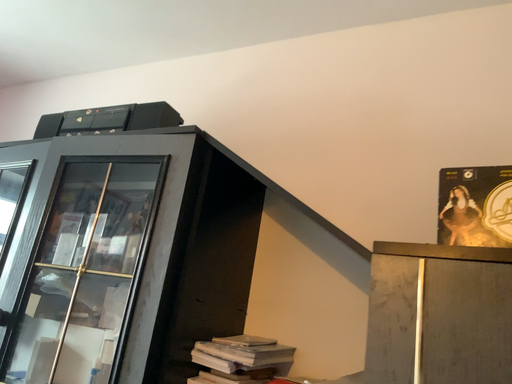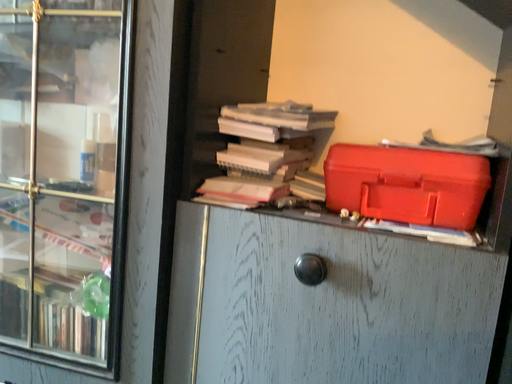
Question: How did the camera likely rotate when shooting the video?

Choices:
 (A) rotated downward
 (B) rotated upward

Answer: (A)